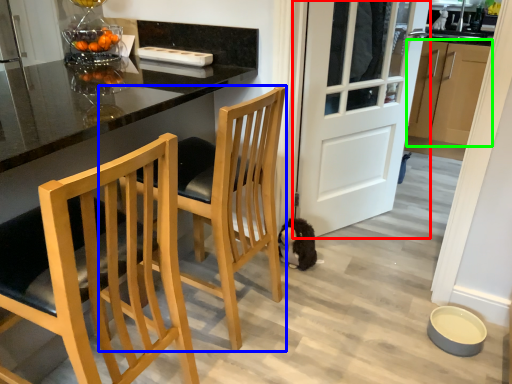
Question: Estimate the real-world distances between objects in this image. Which object is farther from door (highlighted by a red box), chair (highlighted by a blue box) or cabinetry (highlighted by a green box)?

Choices:
 (A) chair
 (B) cabinetry

Answer: (B)